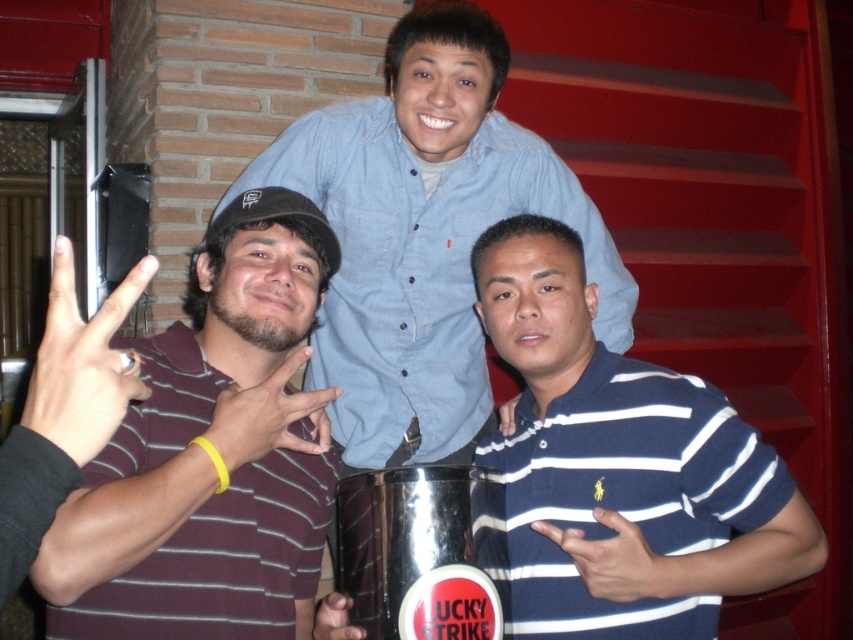
Can you confirm if blue denim shirt at upper center is thinner than shiny metallic can at center?

No.

Can you confirm if blue denim shirt at upper center is positioned to the right of shiny metallic can at center?

Correct, you'll find blue denim shirt at upper center to the right of shiny metallic can at center.

Describe the element at coordinates (421, 268) in the screenshot. I see `blue denim shirt at upper center` at that location.

I want to click on blue denim shirt at upper center, so click(x=421, y=268).

Does maroon striped shirt at center have a larger size compared to blue striped polo shirt at center?

No.

Is point (134, 456) behind point (674, 387)?

That is False.

Which is behind, point (108, 492) or point (776, 516)?

The point (776, 516) is behind.

I want to click on maroon striped shirt at center, so click(212, 454).

Is maroon striped shirt at center closer to camera compared to blue denim shirt at upper center?

Yes, maroon striped shirt at center is in front of blue denim shirt at upper center.

Does maroon striped shirt at center have a larger size compared to blue denim shirt at upper center?

Incorrect, maroon striped shirt at center is not larger than blue denim shirt at upper center.

Measure the distance between maroon striped shirt at center and camera.

The distance of maroon striped shirt at center from camera is 3.28 feet.

Locate an element on the screen. maroon striped shirt at center is located at coordinates (x=212, y=454).